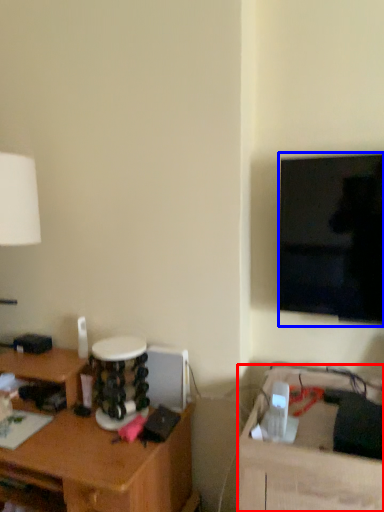
Question: Which object is closer to the camera taking this photo, table (highlighted by a red box) or television (highlighted by a blue box)?

Choices:
 (A) table
 (B) television

Answer: (A)